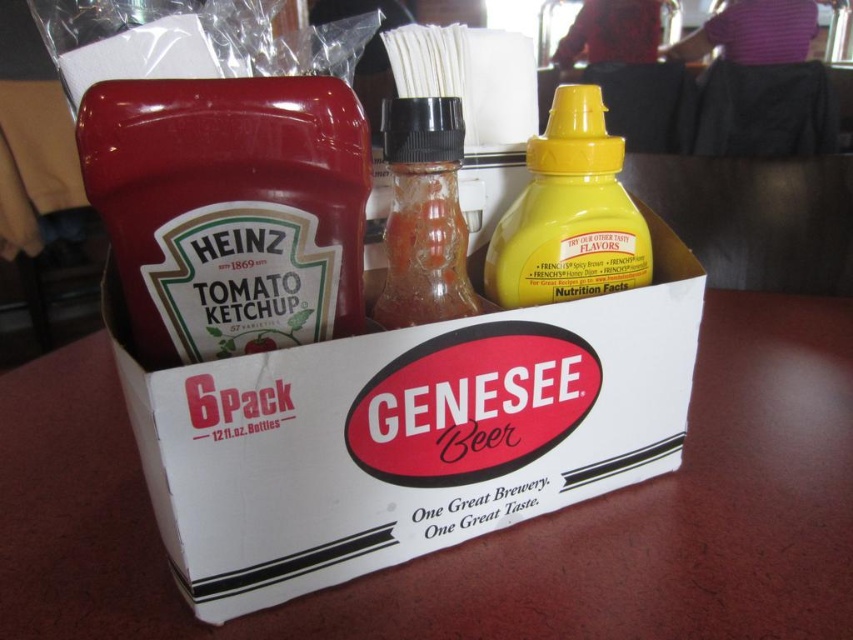
Does white cardboard box at center have a lesser width compared to yellow matte mustard at center?

In fact, white cardboard box at center might be wider than yellow matte mustard at center.

Is white cardboard box at center behind yellow matte mustard at center?

No, it is not.

Where is `white cardboard box at center`? The width and height of the screenshot is (853, 640). white cardboard box at center is located at coordinates (405, 433).

Is matte glass bottle at center closer to the viewer compared to yellow matte mustard at center?

Yes, matte glass bottle at center is in front of yellow matte mustard at center.

Is point (154, 128) more distant than point (561, 275)?

That is False.

You are a GUI agent. You are given a task and a screenshot of the screen. Output one action in this format:
    pyautogui.click(x=<x>, y=<y>)
    Task: Click on the matte glass bottle at center
    This screenshot has height=640, width=853.
    Given the screenshot: What is the action you would take?
    pyautogui.click(x=229, y=209)

Between point (505, 221) and point (416, 259), which one is positioned behind?

Positioned behind is point (505, 221).

Does yellow matte mustard at center lie behind translucent glass bottle at center?

Yes, yellow matte mustard at center is behind translucent glass bottle at center.

This screenshot has width=853, height=640. Find the location of `yellow matte mustard at center`. yellow matte mustard at center is located at coordinates (569, 214).

Where is `yellow matte mustard at center`? yellow matte mustard at center is located at coordinates (569, 214).